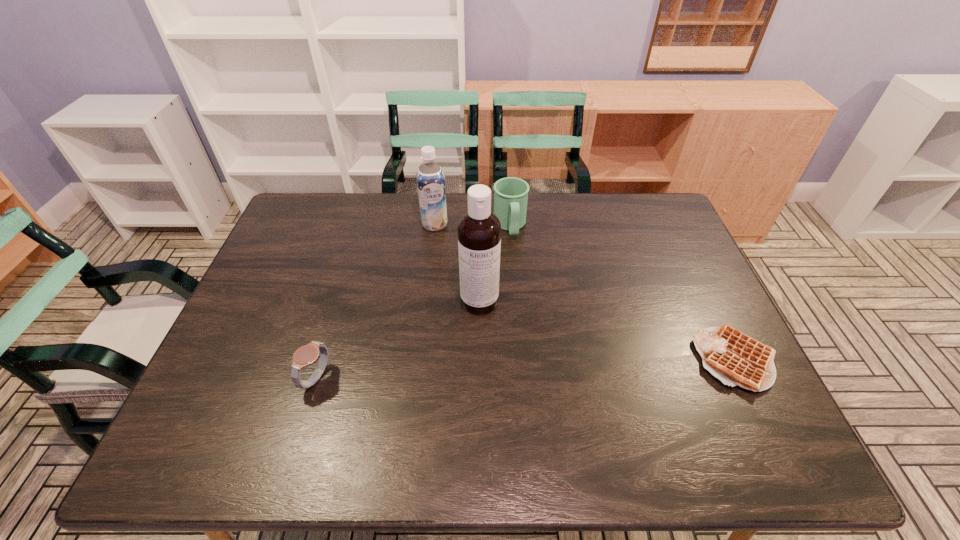
Locate an element on the screen. free region that satisfies the following two spatial constraints: 1. on the front side of the third tallest object; 2. on the right side of the waffle is located at coordinates (520, 360).